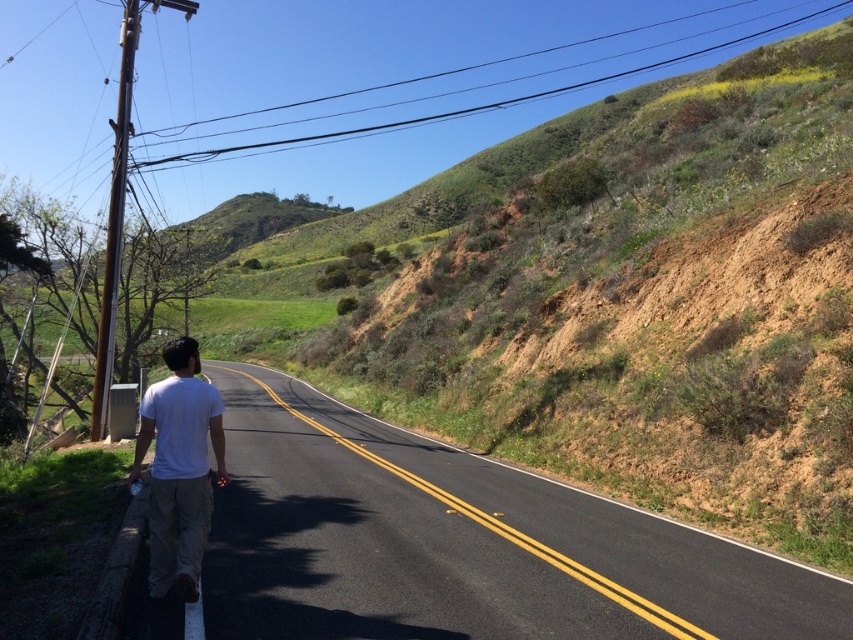
Question: Among these points, which one is farthest from the camera?

Choices:
 (A) (810, 602)
 (B) (189, 563)

Answer: (A)

Question: Which point appears farthest from the camera in this image?

Choices:
 (A) (198, 426)
 (B) (265, 449)

Answer: (B)

Question: Is black asphalt highway at center above white cotton shirt at center?

Choices:
 (A) yes
 (B) no

Answer: (B)

Question: Is black asphalt highway at center further to the viewer compared to white cotton shirt at center?

Choices:
 (A) no
 (B) yes

Answer: (A)

Question: Which of the following is the closest to the observer?

Choices:
 (A) white cotton shirt at center
 (B) black asphalt highway at center

Answer: (B)

Question: Can you confirm if black asphalt highway at center is positioned to the right of white cotton shirt at center?

Choices:
 (A) yes
 (B) no

Answer: (A)